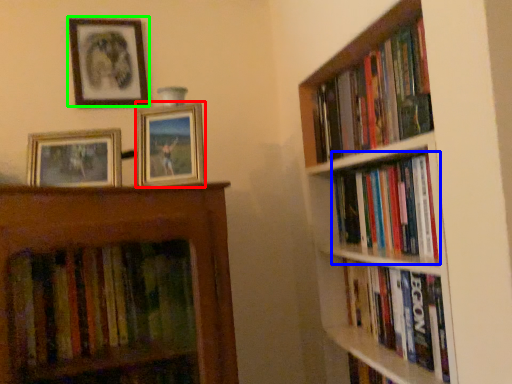
Question: Which is farther away from picture frame (highlighted by a red box)? book (highlighted by a blue box) or picture frame (highlighted by a green box)?

Choices:
 (A) book
 (B) picture frame

Answer: (A)